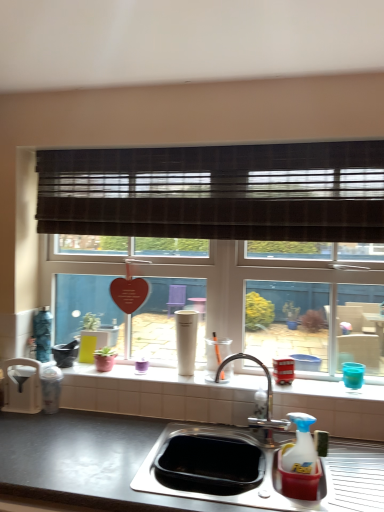
At what (x,y) coordinates should I click in order to perform the action: click on vacant space that is to the left of white matte cup at center, the third appliance viewed from the right. Please return your answer as a coordinate pair (x, y). This screenshot has height=512, width=384. Looking at the image, I should click on (156, 371).